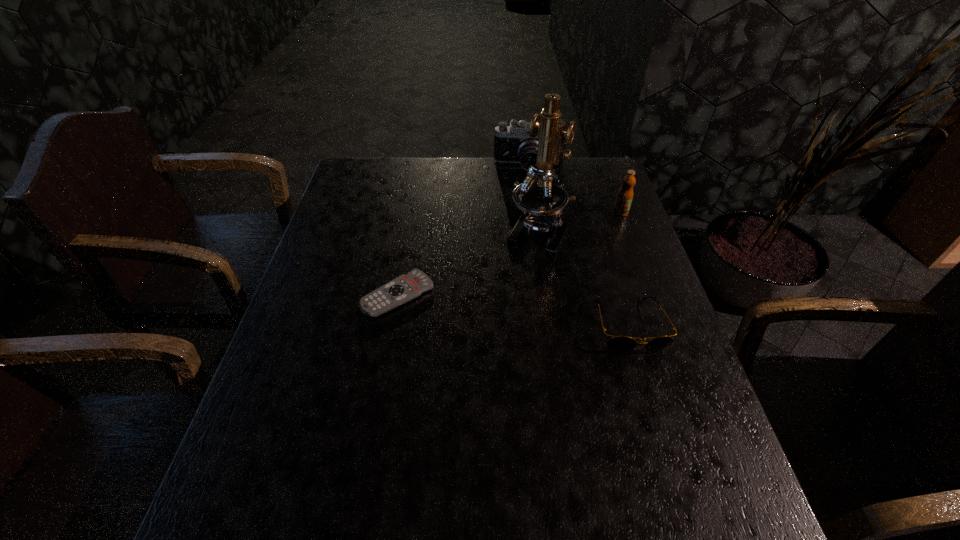
The width and height of the screenshot is (960, 540). I want to click on free space on the desktop that is between the remote control and the second shortest object and is positioned on the front-facing side of the farthest object, so (x=524, y=312).

Where is `free space on the desktop that is between the leftmost object and the sunglasses and is positioned at the eyepiece of the tallest object`? The height and width of the screenshot is (540, 960). free space on the desktop that is between the leftmost object and the sunglasses and is positioned at the eyepiece of the tallest object is located at coordinates point(492,307).

Find the location of `vacant spot on the desktop that is between the shortest object and the second shortest object and is positioned on the front label of the orange juice`. vacant spot on the desktop that is between the shortest object and the second shortest object and is positioned on the front label of the orange juice is located at coordinates (516, 310).